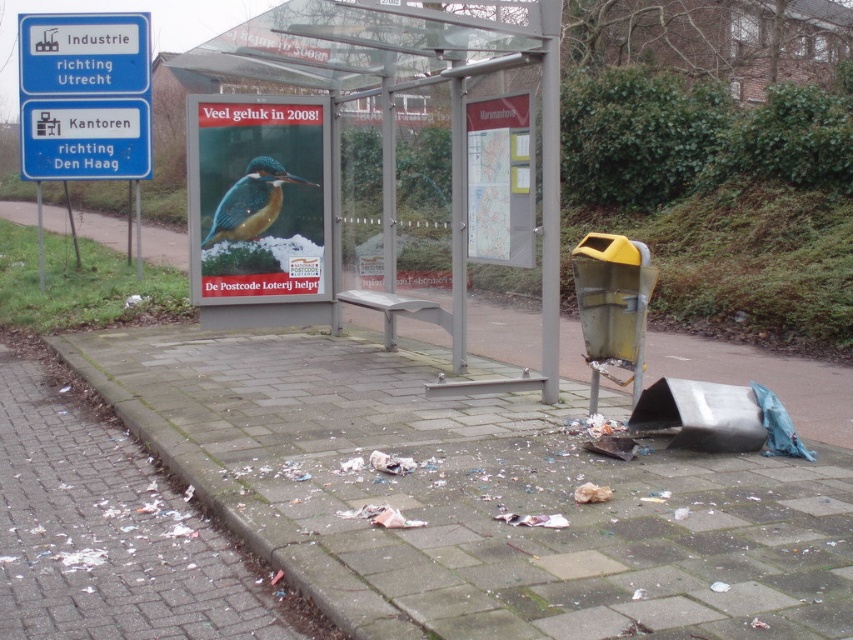
You are a delivery person carrying a large package and need to step onto the transparent glass bus stop at center from the white brick pavement at lower left. Considering their heights, will you need to climb up or step down?

The transparent glass bus stop at center has a greater height compared to the white brick pavement at lower left, so you will need to climb up to step onto it.

You are standing at the bus stop and want to check the distance between two points marked in the image. The first point is at coordinate point (426, 17) and the second is at point (90, 476). Which point is closer to you?

Point (90, 476) is closer to you than point (426, 17).